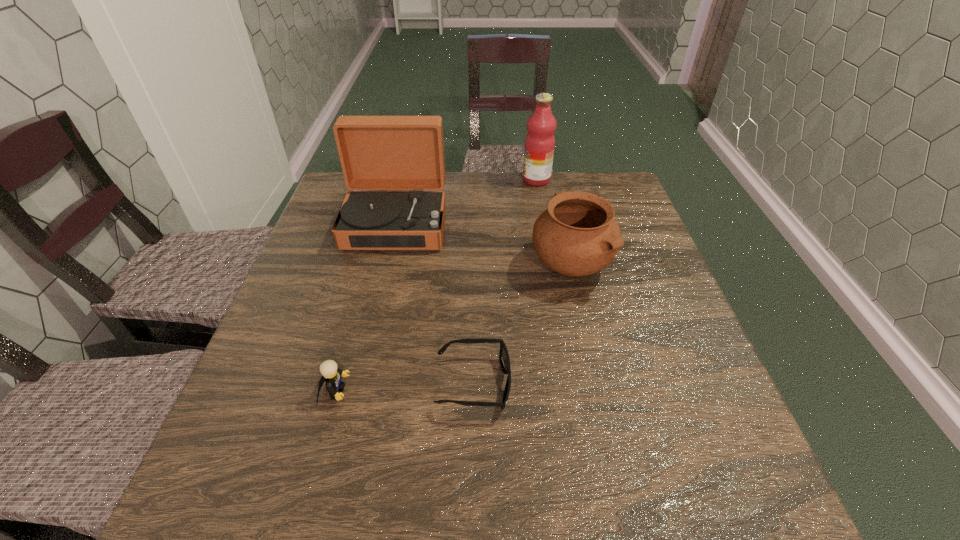
Locate an element on the screen. free region located 0.270m on the front of the pottery is located at coordinates (600, 399).

Locate an element on the screen. blank space located 0.330m on the front-facing side of the Lego is located at coordinates (526, 392).

Identify the location of vacant space located 0.160m on the front-facing side of the sunglasses. This screenshot has width=960, height=540. pyautogui.click(x=594, y=383).

I want to click on fruit juice at the far edge, so click(x=540, y=142).

This screenshot has height=540, width=960. Identify the location of phonograph record that is at the far edge. (376, 152).

The image size is (960, 540). I want to click on phonograph record that is at the left edge, so click(x=376, y=152).

This screenshot has height=540, width=960. I want to click on Lego positioned at the left edge, so click(x=331, y=374).

Image resolution: width=960 pixels, height=540 pixels. What are the coordinates of `object situated at the right edge` in the screenshot? It's located at (577, 235).

The width and height of the screenshot is (960, 540). Identify the location of object that is at the far left corner. (376, 152).

Where is `vacant space at the far edge of the desktop`? This screenshot has height=540, width=960. vacant space at the far edge of the desktop is located at coordinates (497, 193).